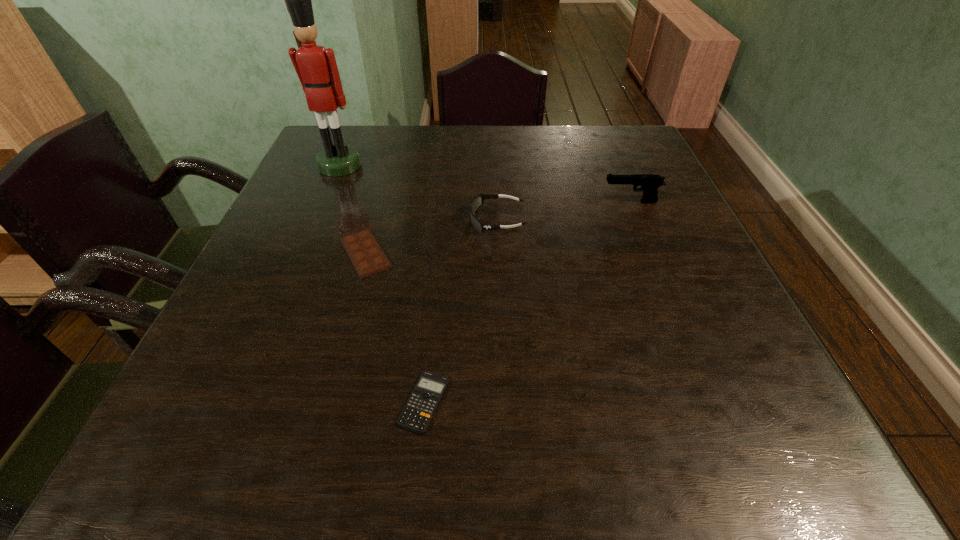
Locate an element on the screen. The image size is (960, 540). vacant space located 0.080m on the front-facing side of the nutcracker is located at coordinates (327, 195).

Where is `free location located on the front-facing side of the pistol`? free location located on the front-facing side of the pistol is located at coordinates (453, 202).

I want to click on vacant space situated on the front-facing side of the pistol, so click(x=498, y=202).

Find the location of `vacant region located on the front-facing side of the pistol`. vacant region located on the front-facing side of the pistol is located at coordinates (519, 202).

The height and width of the screenshot is (540, 960). In order to click on vacant space situated 0.260m on the front and sides of the second object from right to left in this screenshot , I will do `click(356, 220)`.

Locate an element on the screen. Image resolution: width=960 pixels, height=540 pixels. vacant region located 0.220m on the front and sides of the second object from right to left is located at coordinates (373, 220).

What are the coordinates of `vacant space located 0.400m on the front and sides of the second object from right to left` in the screenshot? It's located at (296, 220).

Where is `vacant space situated 0.060m on the back of the second object from left to right`? vacant space situated 0.060m on the back of the second object from left to right is located at coordinates (376, 214).

Where is `free space located 0.150m on the right of the calculator`? Image resolution: width=960 pixels, height=540 pixels. free space located 0.150m on the right of the calculator is located at coordinates (544, 402).

Find the location of a particular element. This screenshot has height=540, width=960. object that is at the far edge is located at coordinates (316, 67).